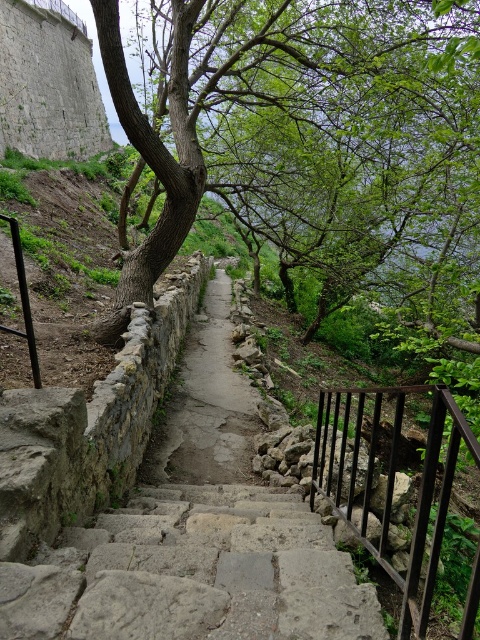
You are standing at the base of the narrow stone staircase and want to reach the top. There are two points marked on the staircase, point (107, 323) and point (208, 336). Which point is closer to you as you start climbing?

Point (107, 323) is closer to the viewer than point (208, 336), so the point (107, 323) is closer to you as you start climbing.